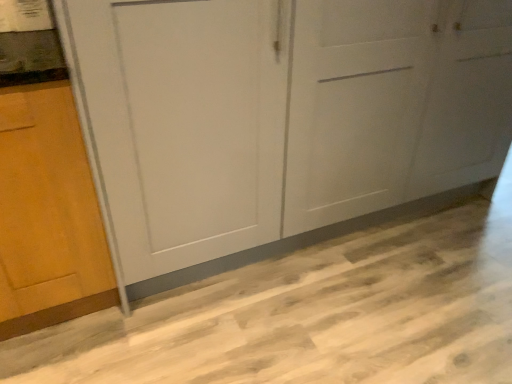
Find the location of a particular element. white matte door at center is located at coordinates (284, 114).

What do you see at coordinates (284, 114) in the screenshot? The height and width of the screenshot is (384, 512). I see `white matte door at center` at bounding box center [284, 114].

In order to click on white matte door at center in this screenshot , I will do `click(284, 114)`.